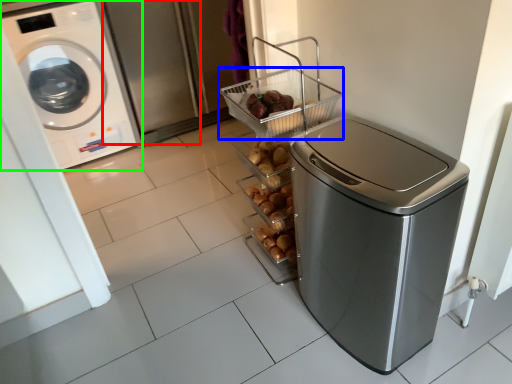
Question: Which is nearer to the screen door (highlighted by a red box)? basket (highlighted by a blue box) or washing machine (highlighted by a green box).

Choices:
 (A) basket
 (B) washing machine

Answer: (B)